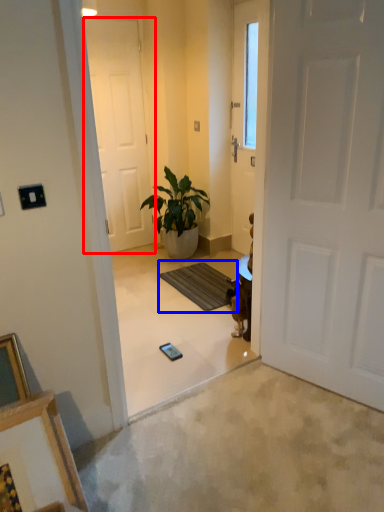
Question: Which object appears farthest to the camera in this image, door (highlighted by a red box) or doormat (highlighted by a blue box)?

Choices:
 (A) door
 (B) doormat

Answer: (A)